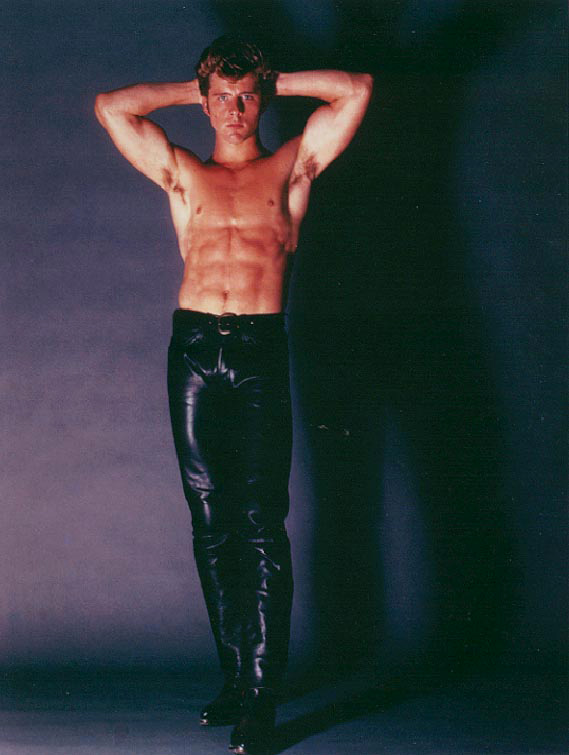
Find the location of a particular element. The width and height of the screenshot is (569, 755). 1980's looking teen poster is located at coordinates (55, 50), (53, 368), (47, 689), (502, 695), (522, 380), (530, 57).